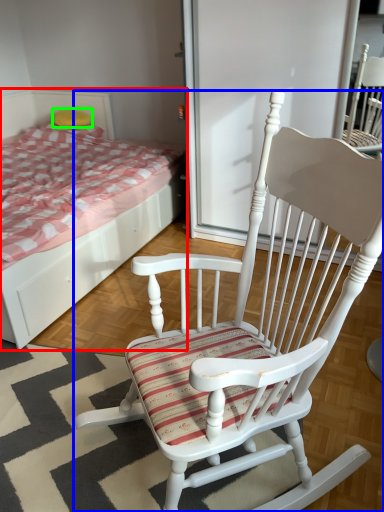
Question: Which is farther away from bed (highlighted by a red box)? chair (highlighted by a blue box) or pillow (highlighted by a green box)?

Choices:
 (A) chair
 (B) pillow

Answer: (B)